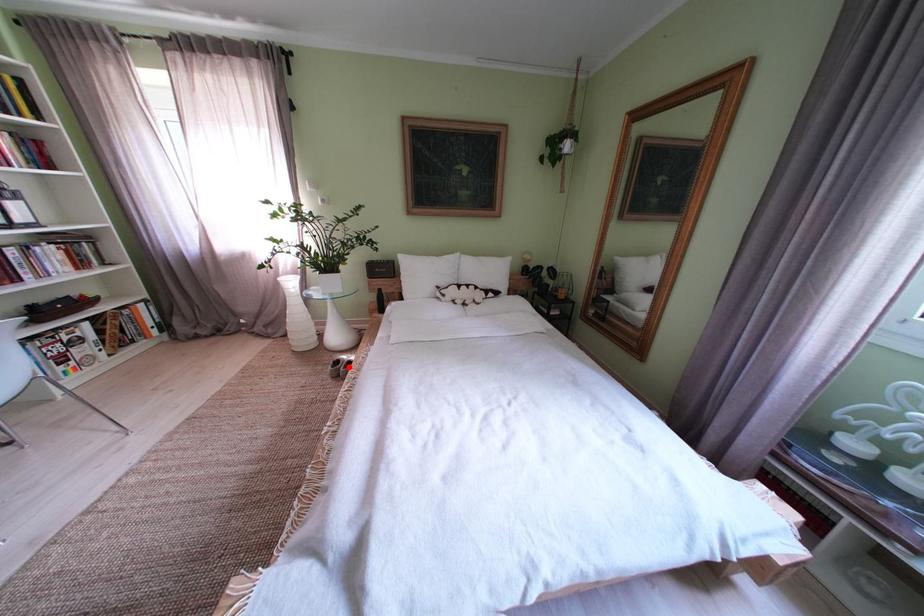
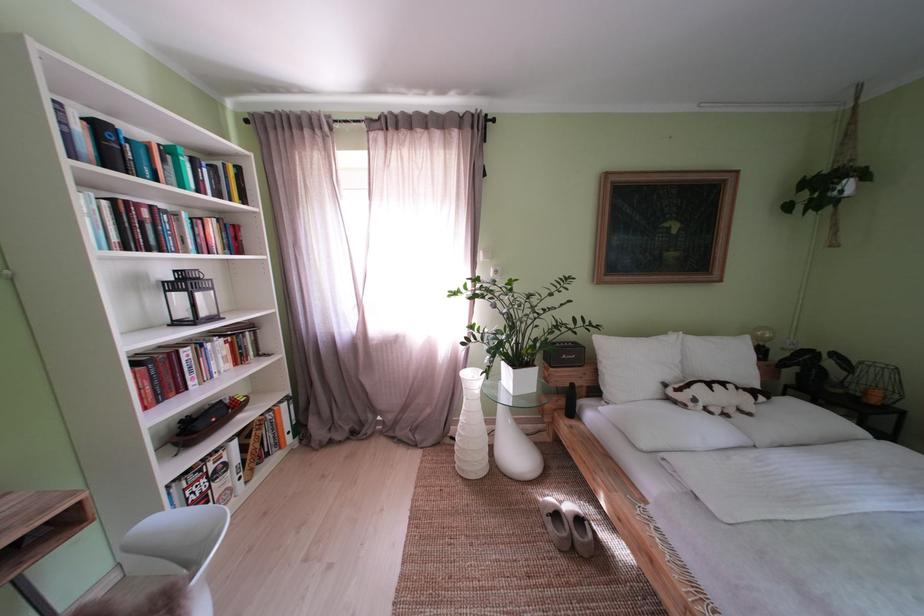
Question: I am providing you with two images of the same scene from different viewpoints. In image1, a red point is highlighted. Considering the same 3D point in image2, which of the following is correct?

Choices:
 (A) It is closer
 (B) It is farther

Answer: (A)